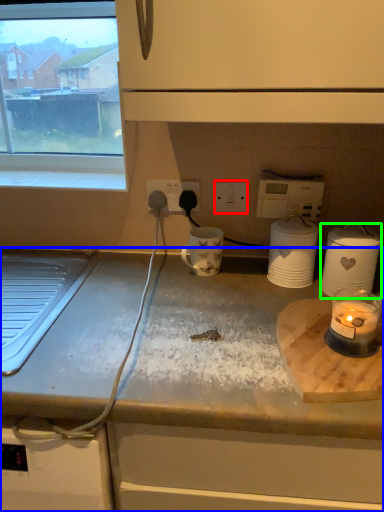
Question: Based on their relative distances, which object is nearer to electric outlet (highlighted by a red box)? Choose from countertop (highlighted by a blue box) and kitchen appliance (highlighted by a green box).

Choices:
 (A) countertop
 (B) kitchen appliance

Answer: (B)